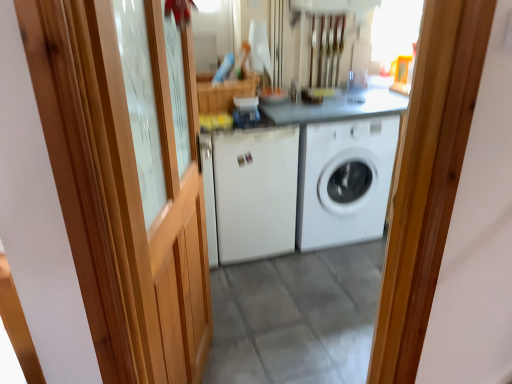
The width and height of the screenshot is (512, 384). I want to click on spots to the right of wooden barn door at left, so click(285, 356).